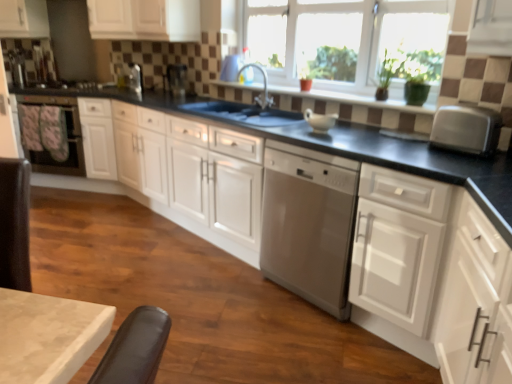
Question: Considering the relative sizes of silver metallic toaster at right and brown tile window sill at center in the image provided, is silver metallic toaster at right shorter than brown tile window sill at center?

Choices:
 (A) no
 (B) yes

Answer: (A)

Question: Is brown tile window sill at center at the back of silver metallic toaster at right?

Choices:
 (A) yes
 (B) no

Answer: (B)

Question: Is silver metallic toaster at right taller than brown tile window sill at center?

Choices:
 (A) no
 (B) yes

Answer: (B)

Question: Is the surface of silver metallic toaster at right in direct contact with brown tile window sill at center?

Choices:
 (A) yes
 (B) no

Answer: (B)

Question: From the image's perspective, is silver metallic toaster at right on brown tile window sill at center?

Choices:
 (A) yes
 (B) no

Answer: (B)

Question: Considering the positions of satin silver dishwasher at center, arranged as the second home appliance when viewed from the back, and white matte cabinet at right, placed as the 1th cabinetry when sorted from right to left, in the image, is satin silver dishwasher at center, arranged as the second home appliance when viewed from the back, wider or thinner than white matte cabinet at right, placed as the 1th cabinetry when sorted from right to left,?

Choices:
 (A) thin
 (B) wide

Answer: (B)

Question: From the image's perspective, is satin silver dishwasher at center, the second home appliance positioned from the left, positioned above or below white matte cabinet at right, placed as the 1th cabinetry when sorted from right to left?

Choices:
 (A) below
 (B) above

Answer: (B)

Question: Considering the positions of satin silver dishwasher at center, which is the first home appliance in front-to-back order, and white matte cabinet at right, placed as the 1th cabinetry when sorted from right to left, in the image, is satin silver dishwasher at center, which is the first home appliance in front-to-back order, taller or shorter than white matte cabinet at right, placed as the 1th cabinetry when sorted from right to left,?

Choices:
 (A) tall
 (B) short

Answer: (A)

Question: From a real-world perspective, is satin silver dishwasher at center, which is the 1th home appliance in right-to-left order, above or below white matte cabinet at right, the fourth cabinetry positioned from the left?

Choices:
 (A) above
 (B) below

Answer: (B)

Question: Is metallic silver toaster at upper center, which appears as the third appliance when viewed from the back, bigger or smaller than satin silver toaster at upper center, which is the second appliance in left-to-right order?

Choices:
 (A) small
 (B) big

Answer: (B)

Question: From the image's perspective, is metallic silver toaster at upper center, which is counted as the 3th appliance, starting from the left, positioned above or below satin silver toaster at upper center, the second appliance in the right-to-left sequence?

Choices:
 (A) above
 (B) below

Answer: (B)

Question: Do you think metallic silver toaster at upper center, the first appliance when ordered from front to back, is within satin silver toaster at upper center, which is the second appliance in left-to-right order, or outside of it?

Choices:
 (A) outside
 (B) inside

Answer: (A)

Question: From their relative heights in the image, would you say metallic silver toaster at upper center, which is counted as the 3th appliance, starting from the left, is taller or shorter than satin silver toaster at upper center, the second appliance when ordered from back to front?

Choices:
 (A) tall
 (B) short

Answer: (A)

Question: Considering the positions of white matte cabinet at upper left, placed as the 4th cabinetry when sorted from right to left, and matte black oven at left, which is counted as the 2th home appliance, starting from the front, in the image, is white matte cabinet at upper left, placed as the 4th cabinetry when sorted from right to left, taller or shorter than matte black oven at left, which is counted as the 2th home appliance, starting from the front,?

Choices:
 (A) short
 (B) tall

Answer: (A)

Question: Is white matte cabinet at upper left, which is the first cabinetry in left-to-right order, in front of or behind matte black oven at left, which is counted as the 2th home appliance, starting from the front, in the image?

Choices:
 (A) front
 (B) behind

Answer: (B)